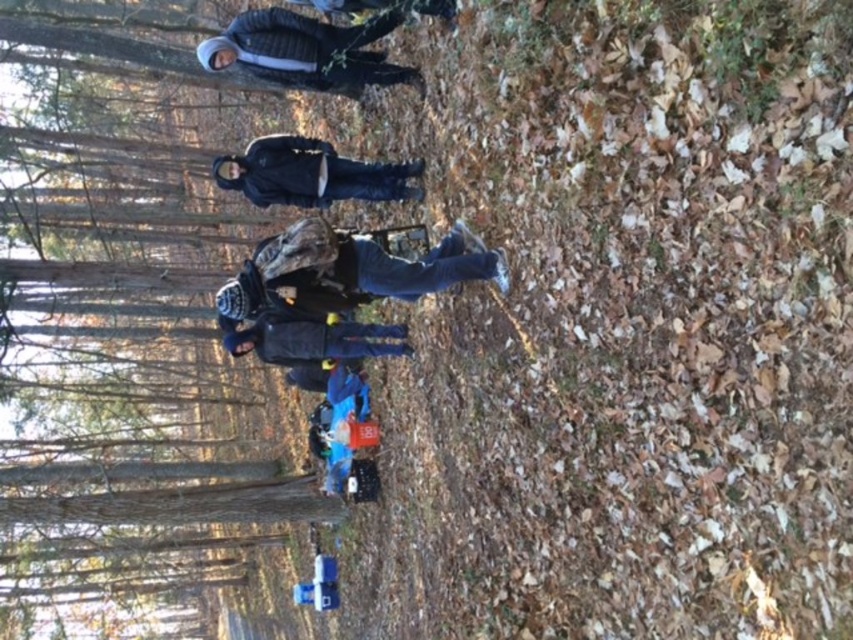
Question: Is brushed metal jacket at upper center thinner than dark gray jacket at center?

Choices:
 (A) yes
 (B) no

Answer: (B)

Question: Can you confirm if camouflage jacket at center is positioned to the right of dark gray jacket at center?

Choices:
 (A) yes
 (B) no

Answer: (A)

Question: Considering the real-world distances, which object is closest to the camouflage jacket at center?

Choices:
 (A) black matte jacket at center
 (B) dark gray jacket at center
 (C) brown wood tree at upper center

Answer: (B)

Question: Among these points, which one is nearest to the camera?

Choices:
 (A) (256, 284)
 (B) (405, 352)
 (C) (277, 150)
 (D) (244, 17)

Answer: (A)

Question: Which of the following is the closest to the observer?

Choices:
 (A) brushed metal jacket at upper center
 (B) black matte jacket at center

Answer: (A)

Question: Can you confirm if black matte jacket at center is smaller than dark gray jacket at center?

Choices:
 (A) no
 (B) yes

Answer: (B)